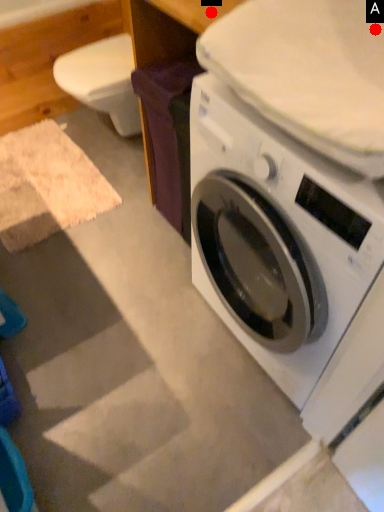
Question: Two points are circled on the image, labeled by A and B beside each circle. Which of the following is the closest to the observer?

Choices:
 (A) A is closer
 (B) B is closer

Answer: (A)